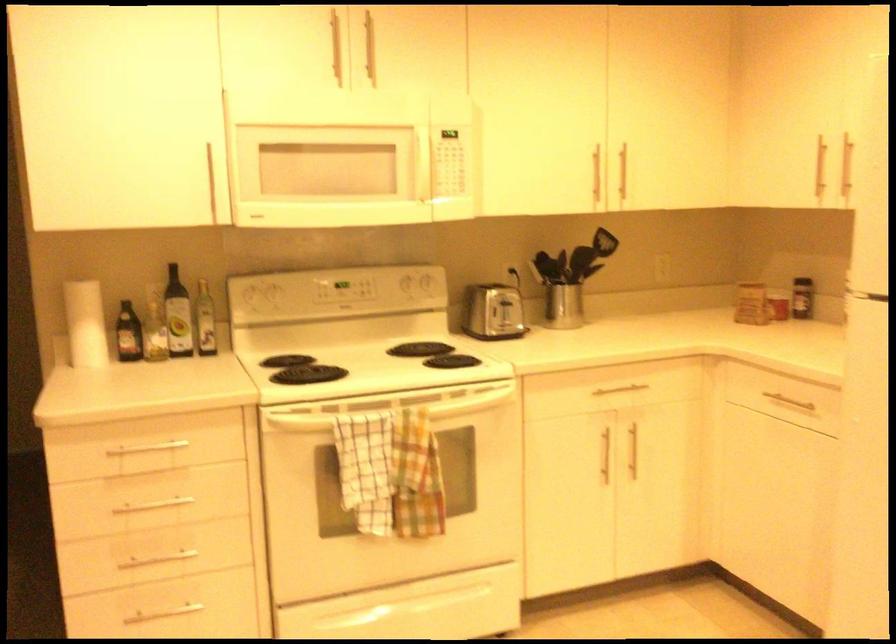
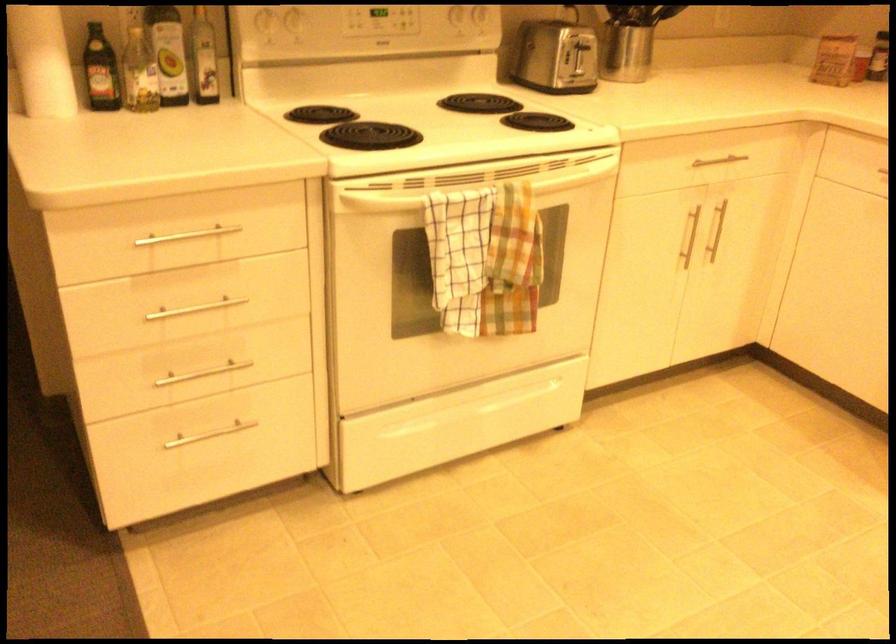
Question: I am providing you with two images of the same scene from different viewpoints. Please identify which objects are invisible in image2.

Choices:
 (A) white stove knob
 (B) white oven handle
 (C) toaster lever
 (D) brass cabinet handle

Answer: (A)